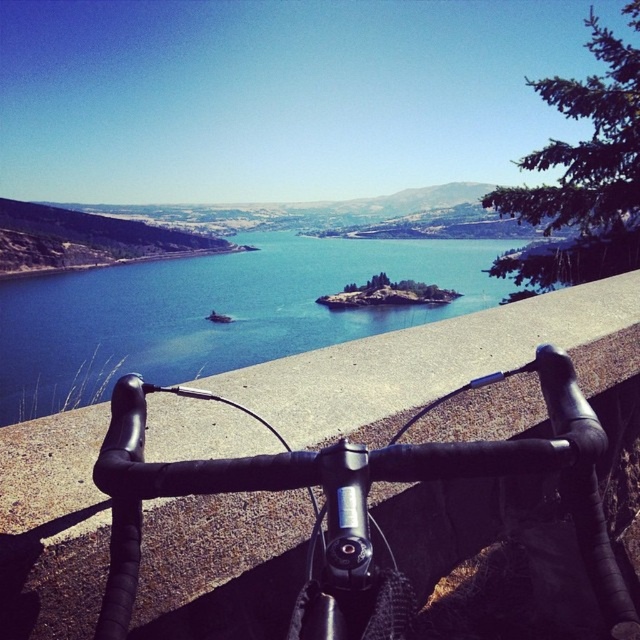
Is blue water at center to the right of black matte bicycle handlebars at center from the viewer's perspective?

Incorrect, blue water at center is not on the right side of black matte bicycle handlebars at center.

Is point (314, 304) farther from viewer compared to point (177, 468)?

Yes, it is behind point (177, 468).

The image size is (640, 640). What are the coordinates of `blue water at center` in the screenshot? It's located at (216, 308).